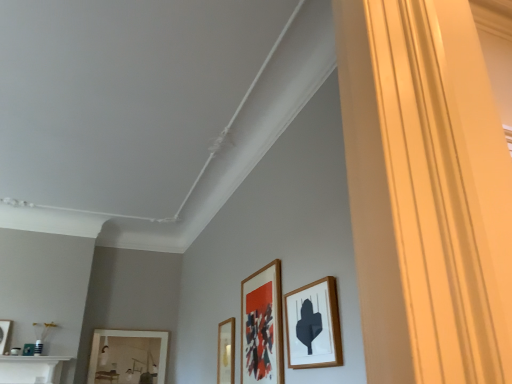
Question: Is wooden picture frame at lower left, placed as the second picture frame when sorted from left to right, in front of or behind wooden picture frame at lower center, which is the 3th picture frame from right to left, in the image?

Choices:
 (A) behind
 (B) front

Answer: (A)

Question: In terms of size, does wooden picture frame at lower left, which is the 5th picture frame from front to back, appear bigger or smaller than wooden picture frame at lower center, positioned as the 3th picture frame in back-to-front order?

Choices:
 (A) big
 (B) small

Answer: (A)

Question: Which is farther from the wooden picture frame at right, which ranks as the first picture frame in front-to-back order?

Choices:
 (A) wooden picture frame at lower left, which is counted as the first picture frame, starting from the back
 (B) matte wooden picture frame at center, marked as the second picture frame in a front-to-back arrangement
 (C) matte white picture frame at lower left, the 5th picture frame from the right
 (D) wooden picture frame at lower center, positioned as the 3th picture frame in back-to-front order

Answer: (C)

Question: Which object is the closest to the matte wooden picture frame at center, acting as the second picture frame starting from the right?

Choices:
 (A) wooden picture frame at lower center, acting as the 3th picture frame starting from the front
 (B) wooden picture frame at right, which ranks as the first picture frame in front-to-back order
 (C) matte white picture frame at lower left, the 5th picture frame from the right
 (D) wooden picture frame at lower left, which is the 5th picture frame from front to back

Answer: (B)